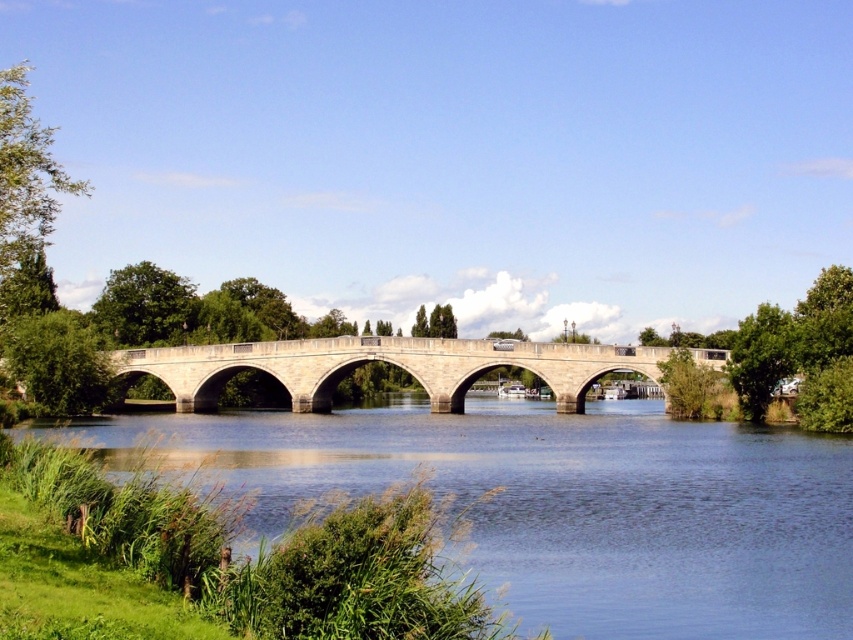
Between blue stone bridge at center and stone bridge at center, which one is positioned higher?

stone bridge at center is higher up.

Is blue stone bridge at center to the left of stone bridge at center from the viewer's perspective?

Incorrect, blue stone bridge at center is not on the left side of stone bridge at center.

Is point (721, 595) positioned in front of point (389, 353)?

That is True.

At what (x,y) coordinates should I click in order to perform the action: click on blue stone bridge at center. Please return your answer as a coordinate pair (x, y). Looking at the image, I should click on (561, 502).